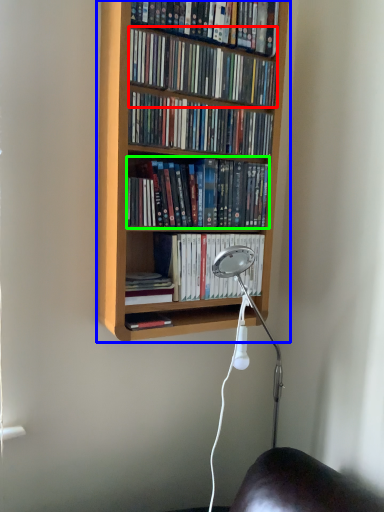
Question: Which object is the farthest from book (highlighted by a red box)? Choose among these: bookcase (highlighted by a blue box) or book (highlighted by a green box).

Choices:
 (A) bookcase
 (B) book

Answer: (B)